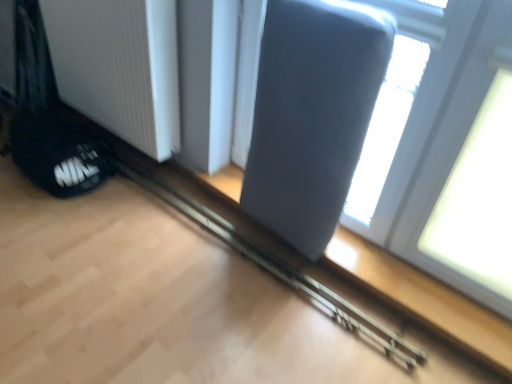
Where is `vacant region in front of black mesh shoe at lower left`? The width and height of the screenshot is (512, 384). vacant region in front of black mesh shoe at lower left is located at coordinates (52, 234).